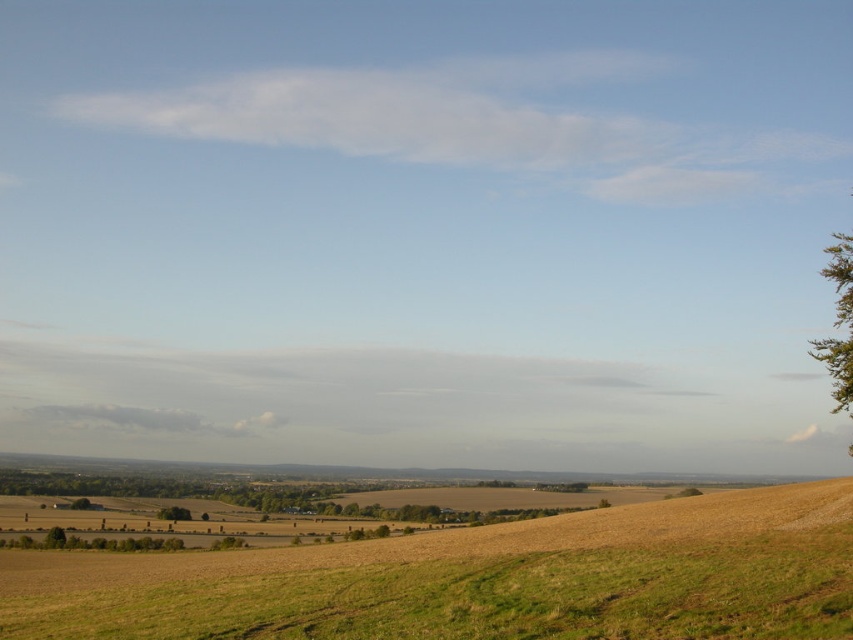
Based on the photo, is green grassy field at lower center smaller than green leafy tree at lower left?

No.

Between green grassy field at lower center and green leafy tree at lower left, which one appears on the right side from the viewer's perspective?

From the viewer's perspective, green grassy field at lower center appears more on the right side.

Which is in front, point (329, 612) or point (178, 509)?

Point (329, 612)

Where is `green grassy field at lower center`? Image resolution: width=853 pixels, height=640 pixels. green grassy field at lower center is located at coordinates (479, 579).